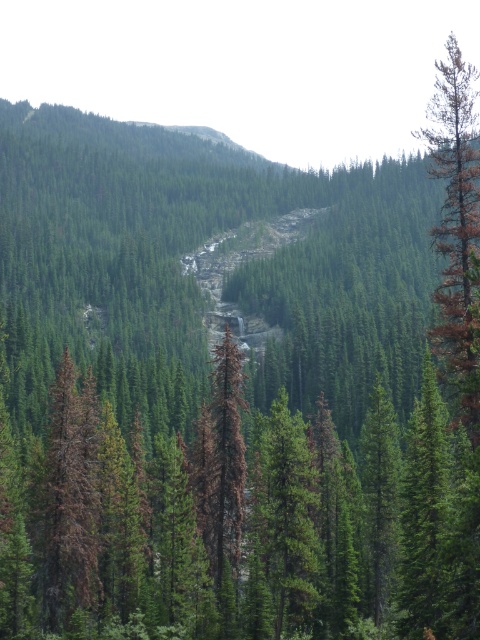
Does point (444, 124) lie in front of point (296, 502)?

Yes, it is.

Describe the element at coordinates (456, 228) in the screenshot. I see `brown/dried wood tree at right` at that location.

Between point (444, 250) and point (298, 600), which one is positioned in front?

Point (444, 250) is in front.

In order to click on brown/dried wood tree at right in this screenshot , I will do `click(456, 228)`.

Consider the image. Is brown/dried wood tree at left thinner than green matte tree at center?

In fact, brown/dried wood tree at left might be wider than green matte tree at center.

Between point (57, 604) and point (276, 525), which one is positioned behind?

The point (276, 525) is behind.

The height and width of the screenshot is (640, 480). Find the location of `brown/dried wood tree at left`. brown/dried wood tree at left is located at coordinates (68, 499).

Locate an element on the screen. Image resolution: width=480 pixels, height=640 pixels. brown/dried wood tree at right is located at coordinates (456, 228).

Find the location of a particular element. brown/dried wood tree at right is located at coordinates (456, 228).